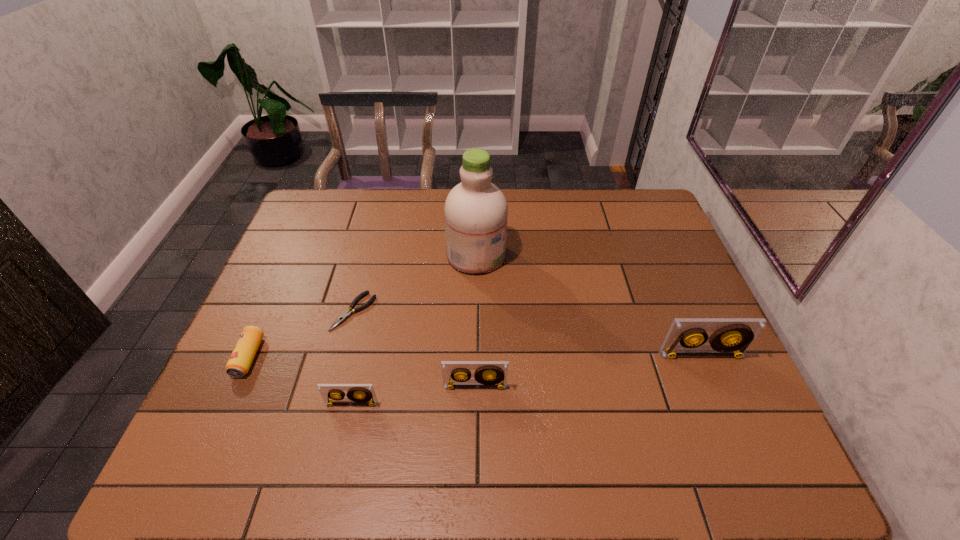
To make them evenly spaced by inserting another videotape among them, please locate a vacant spot for this new videotape. Please provide its 2D coordinates. Your answer should be formatted as a tuple, i.e. [(x, y)], where the tuple contains the x and y coordinates of a point satisfying the conditions above.

[(591, 370)]